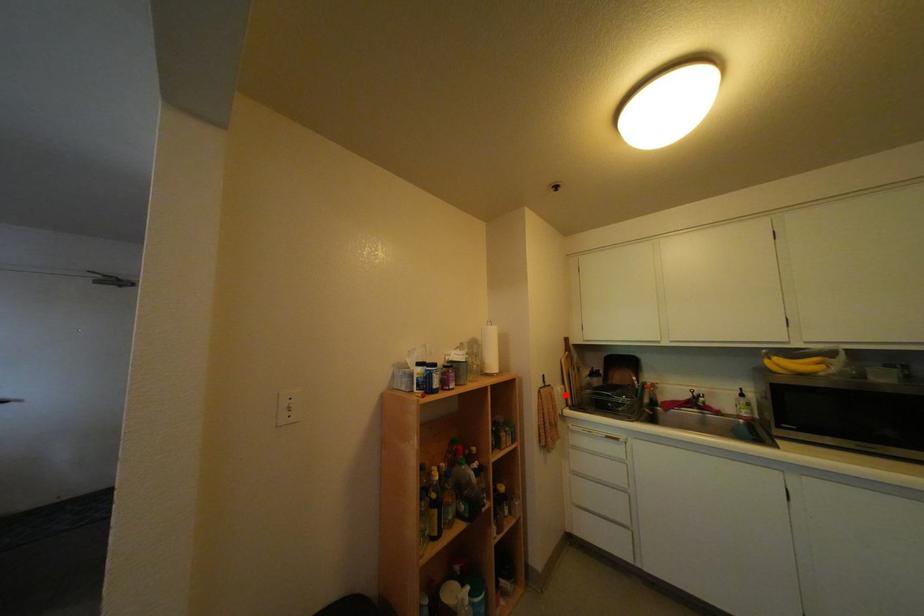
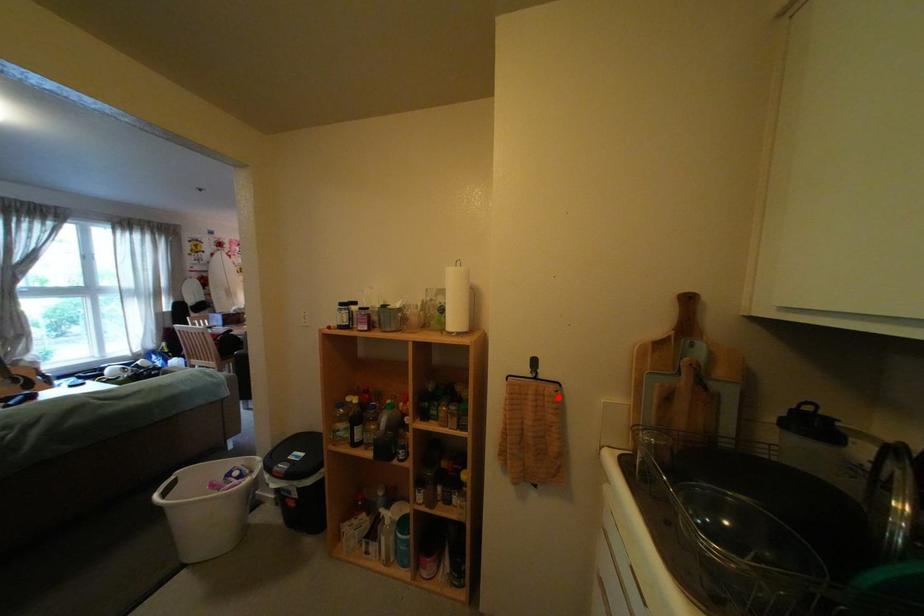
I am providing you with two images of the same scene from different viewpoints. A red point is marked on the first image and another point is marked on the second image. Does the point marked in image1 correspond to the same location as the one in image2?

Yes